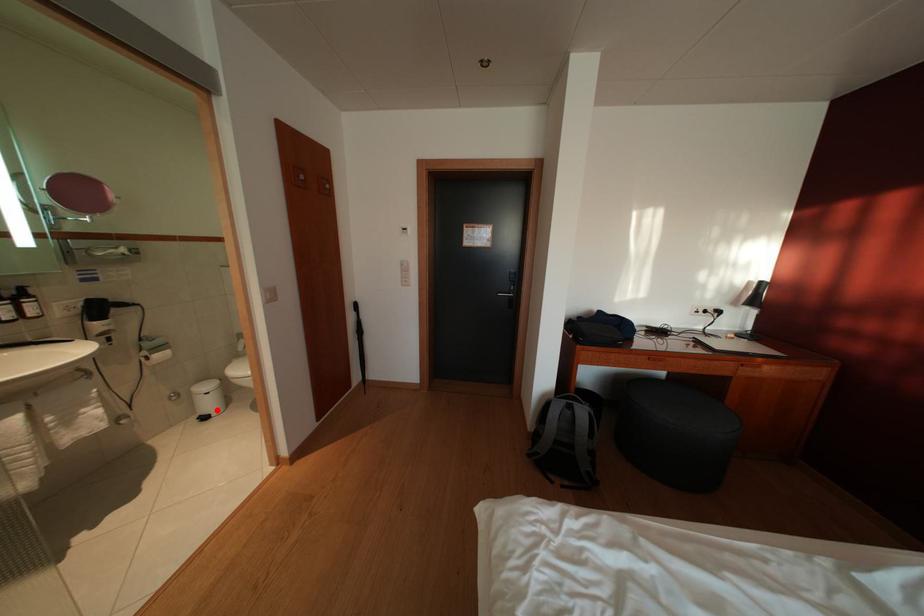
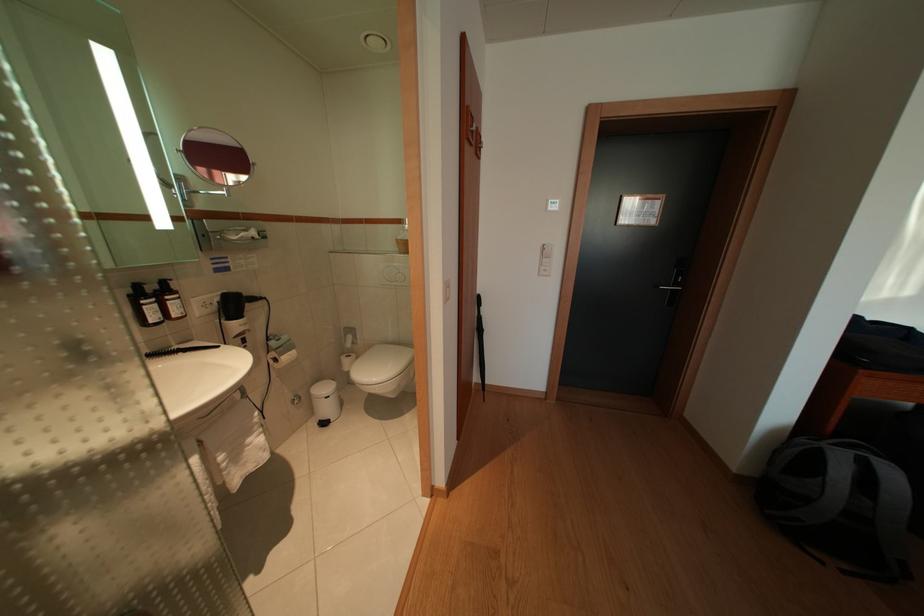
The point at the highlighted location is marked in the first image. Where is the corresponding point in the second image?

(335, 415)